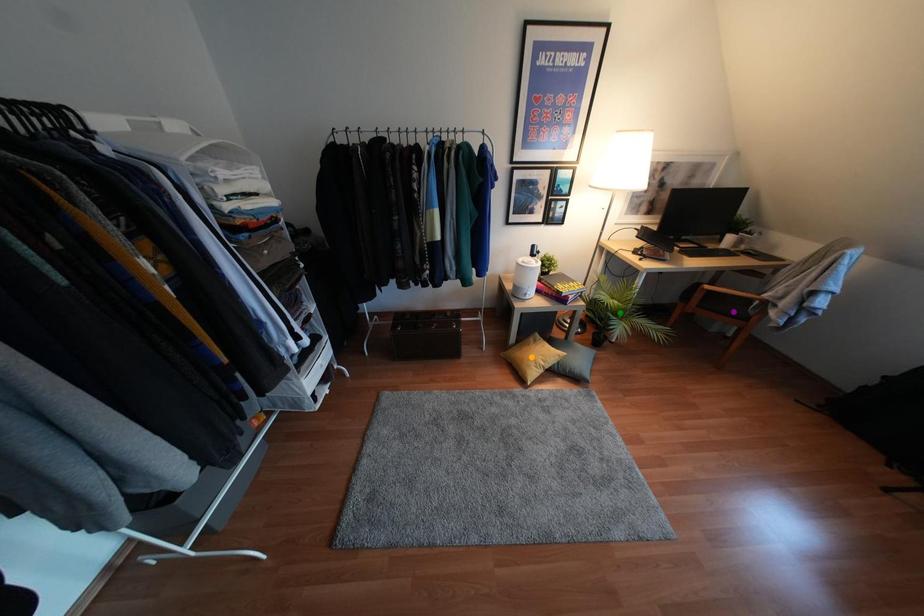
Order these from nearest to farthest:
1. purple point
2. green point
3. orange point

1. purple point
2. orange point
3. green point